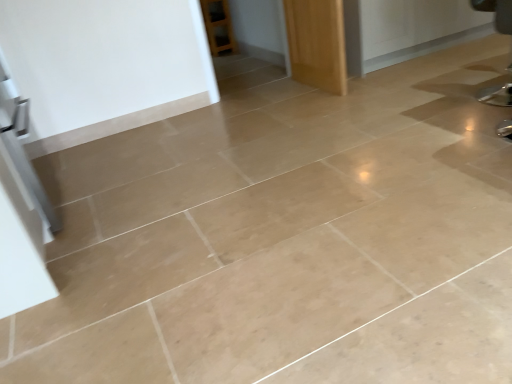
The height and width of the screenshot is (384, 512). In order to click on wooden door at upper center in this screenshot , I will do `click(317, 43)`.

The height and width of the screenshot is (384, 512). What do you see at coordinates (317, 43) in the screenshot?
I see `wooden door at upper center` at bounding box center [317, 43].

Describe the element at coordinates (497, 13) in the screenshot. I see `metallic silver swivel chair at right` at that location.

Identify the location of metallic silver swivel chair at right. This screenshot has width=512, height=384. (497, 13).

Where is `wooden door at upper center`? wooden door at upper center is located at coordinates (317, 43).

Which is more to the right, metallic silver swivel chair at right or wooden door at upper center?

metallic silver swivel chair at right.

Is the position of metallic silver swivel chair at right less distant than that of wooden door at upper center?

Yes, metallic silver swivel chair at right is closer to the viewer.

Is point (471, 3) more distant than point (306, 49)?

Yes, it is.

From the image's perspective, between metallic silver swivel chair at right and wooden door at upper center, who is located below?

metallic silver swivel chair at right, from the image's perspective.

From a real-world perspective, who is located higher, metallic silver swivel chair at right or wooden door at upper center?

From a 3D spatial view, metallic silver swivel chair at right is above.

Which object is wider, metallic silver swivel chair at right or wooden door at upper center?

Wider between the two is metallic silver swivel chair at right.

Does metallic silver swivel chair at right have a lesser height compared to wooden door at upper center?

In fact, metallic silver swivel chair at right may be taller than wooden door at upper center.

Is metallic silver swivel chair at right smaller than wooden door at upper center?

Yes.

Is metallic silver swivel chair at right positioned beyond the bounds of wooden door at upper center?

Yes, metallic silver swivel chair at right is outside of wooden door at upper center.

Is metallic silver swivel chair at right positioned far away from wooden door at upper center?

Absolutely, metallic silver swivel chair at right is distant from wooden door at upper center.

Is metallic silver swivel chair at right oriented away from wooden door at upper center?

No, metallic silver swivel chair at right's orientation is not away from wooden door at upper center.

Locate an element on the screen. This screenshot has height=384, width=512. swivel chair located below the wooden door at upper center (from the image's perspective) is located at coordinates (497, 13).

Is wooden door at upper center at the left side of metallic silver swivel chair at right?

Yes.

Is the position of wooden door at upper center more distant than that of metallic silver swivel chair at right?

Yes, wooden door at upper center is further from the viewer.

Considering the points (323, 66) and (497, 102), which point is in front, point (323, 66) or point (497, 102)?

Point (497, 102)

From the picture: From the image's perspective, would you say wooden door at upper center is shown under metallic silver swivel chair at right?

Incorrect, from the image's perspective, wooden door at upper center is higher than metallic silver swivel chair at right.

From a real-world perspective, who is located higher, wooden door at upper center or metallic silver swivel chair at right?

metallic silver swivel chair at right.

Looking at their sizes, would you say wooden door at upper center is wider or thinner than metallic silver swivel chair at right?

wooden door at upper center is thinner than metallic silver swivel chair at right.

Who is shorter, wooden door at upper center or metallic silver swivel chair at right?

Standing shorter between the two is wooden door at upper center.

Does wooden door at upper center have a larger size compared to metallic silver swivel chair at right?

Correct, wooden door at upper center is larger in size than metallic silver swivel chair at right.

Is wooden door at upper center spatially inside metallic silver swivel chair at right, or outside of it?

wooden door at upper center cannot be found inside metallic silver swivel chair at right.

Is wooden door at upper center directly adjacent to metallic silver swivel chair at right?

wooden door at upper center and metallic silver swivel chair at right are clearly separated.

Is wooden door at upper center oriented towards metallic silver swivel chair at right?

No, wooden door at upper center is not facing towards metallic silver swivel chair at right.

How different are the orientations of wooden door at upper center and metallic silver swivel chair at right in degrees?

178 degrees separate the facing orientations of wooden door at upper center and metallic silver swivel chair at right.

How far apart are wooden door at upper center and metallic silver swivel chair at right?

wooden door at upper center and metallic silver swivel chair at right are 5.58 feet apart from each other.

Locate an element on the screen. door on the left of metallic silver swivel chair at right is located at coordinates 317,43.

The width and height of the screenshot is (512, 384). I want to click on door above the metallic silver swivel chair at right (from the image's perspective), so click(317, 43).

You are a GUI agent. You are given a task and a screenshot of the screen. Output one action in this format:
    pyautogui.click(x=<x>, y=<y>)
    Task: Click on the door that is under the metallic silver swivel chair at right (from a real-world perspective)
    
    Given the screenshot: What is the action you would take?
    pyautogui.click(x=317, y=43)